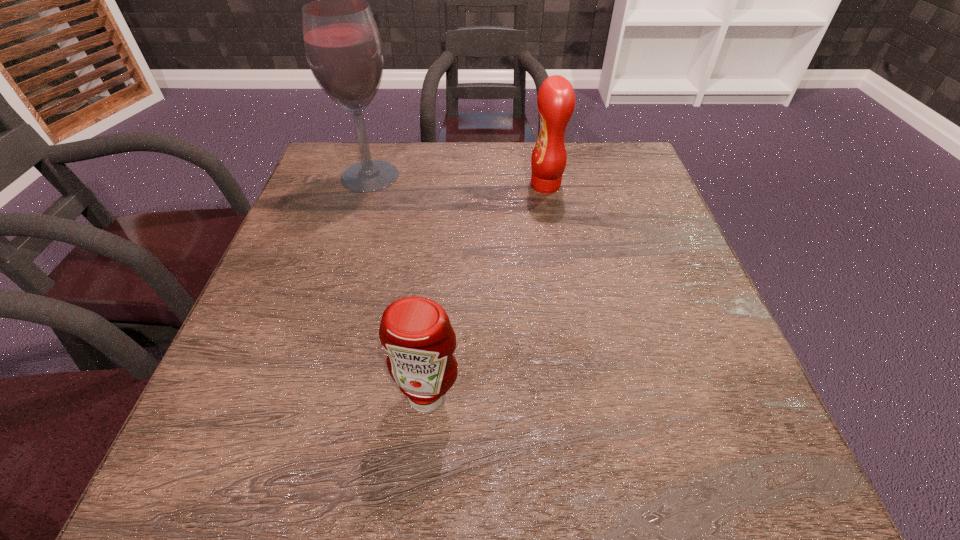
Locate an element on the screen. This screenshot has height=540, width=960. alcohol is located at coordinates (343, 47).

Find the location of a particular element. the tallest object is located at coordinates (343, 47).

Locate an element on the screen. The image size is (960, 540). the second tallest object is located at coordinates (556, 99).

The width and height of the screenshot is (960, 540). I want to click on the farther condiment, so click(x=556, y=99).

Find the location of a particular element. The width and height of the screenshot is (960, 540). the shortest object is located at coordinates (416, 332).

Locate an element on the screen. This screenshot has height=540, width=960. the second object from right to left is located at coordinates (416, 332).

At what (x,y) coordinates should I click in order to perform the action: click on vacant space located 0.330m on the front of the tallest object. Please return your answer as a coordinate pair (x, y). Image resolution: width=960 pixels, height=540 pixels. Looking at the image, I should click on (334, 294).

Where is `vacant space located on the label side of the rightmost object`? Image resolution: width=960 pixels, height=540 pixels. vacant space located on the label side of the rightmost object is located at coordinates (505, 185).

Where is `vacant space located 0.100m on the label side of the rightmost object`? Image resolution: width=960 pixels, height=540 pixels. vacant space located 0.100m on the label side of the rightmost object is located at coordinates (490, 185).

I want to click on vacant point located on the label side of the rightmost object, so click(442, 185).